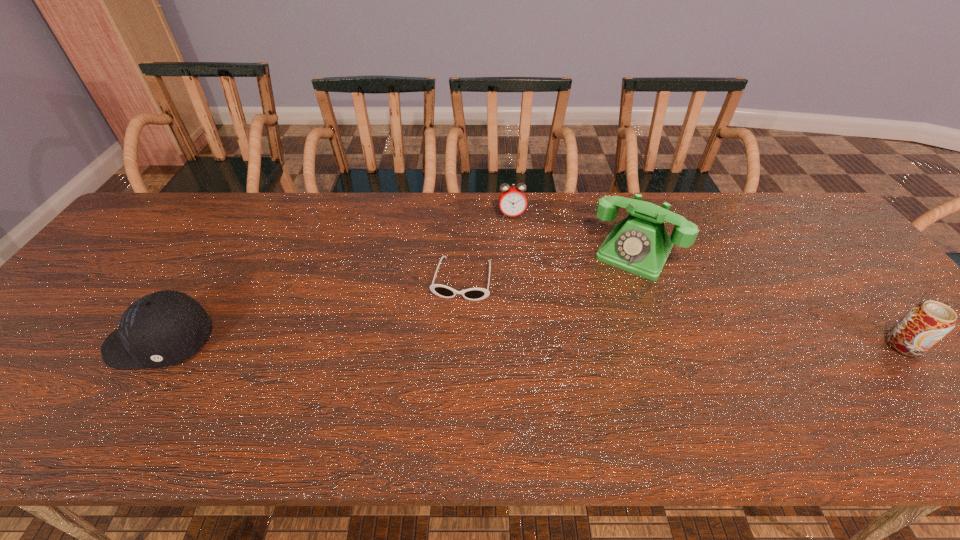
Find the location of `vacant area that lies between the baseball cap and the rightmost object`. vacant area that lies between the baseball cap and the rightmost object is located at coordinates (532, 344).

Where is `free area in between the sunglasses and the baseball cap`? This screenshot has height=540, width=960. free area in between the sunglasses and the baseball cap is located at coordinates (311, 311).

This screenshot has height=540, width=960. I want to click on free space between the second object from right to left and the leftmost object, so click(x=397, y=298).

This screenshot has width=960, height=540. I want to click on blank region between the fourth object from left to right and the leftmost object, so click(x=397, y=298).

Locate an element on the screen. This screenshot has height=540, width=960. empty space between the leftmost object and the telephone is located at coordinates (397, 298).

The image size is (960, 540). I want to click on vacant area that lies between the farthest object and the second object from left to right, so click(x=487, y=247).

The image size is (960, 540). I want to click on empty space between the third object from right to left and the rightmost object, so click(708, 280).

I want to click on empty space that is in between the third object from left to right and the sunglasses, so click(x=487, y=247).

I want to click on free area in between the leftmost object and the fourth object from right to left, so 311,311.

Identify which object is the fourth nearest to the shortest object. Please provide its 2D coordinates. Your answer should be formatted as a tuple, i.e. [(x, y)], where the tuple contains the x and y coordinates of a point satisfying the conditions above.

[(926, 323)]